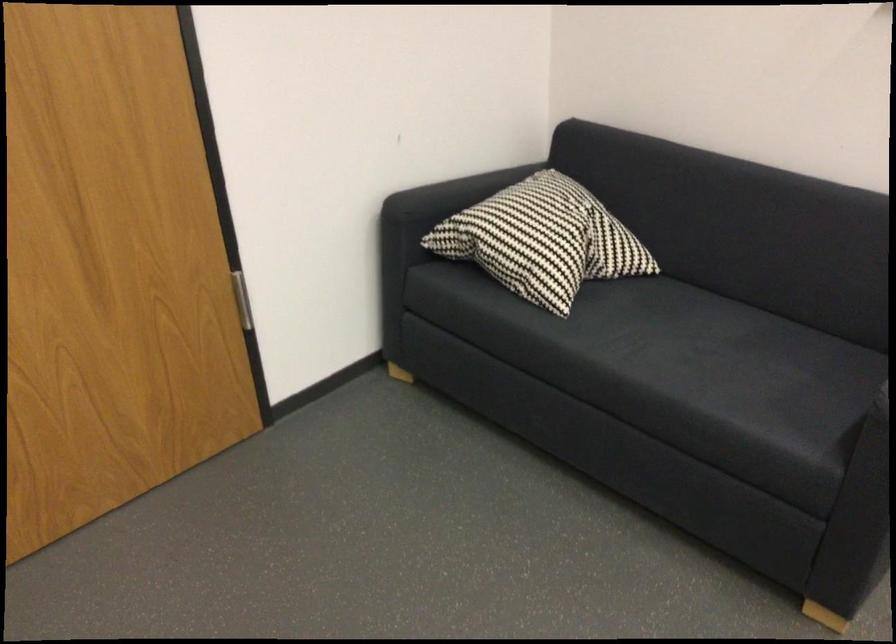
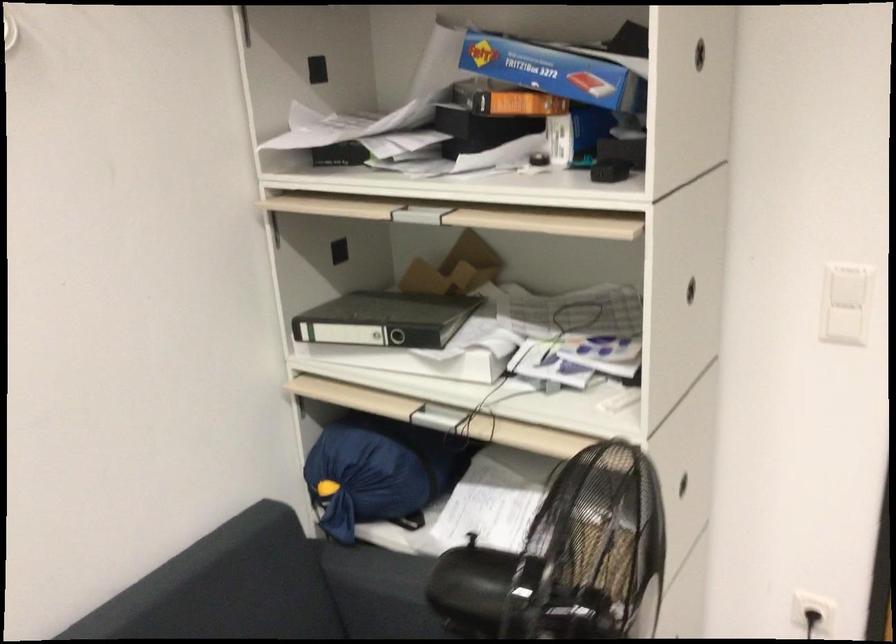
Question: The images are taken continuously from a first-person perspective. In which direction is your viewpoint rotating?

Choices:
 (A) Left
 (B) Right
 (C) Up
 (D) Down

Answer: (A)